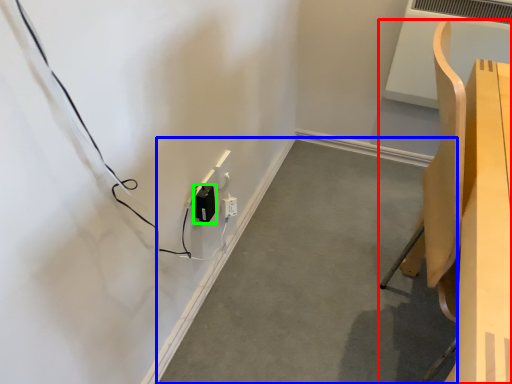
Question: Considering the real-world distances, which object is closest to furniture (highlighted by a red box)? concrete (highlighted by a blue box) or electric outlet (highlighted by a green box).

Choices:
 (A) concrete
 (B) electric outlet

Answer: (A)